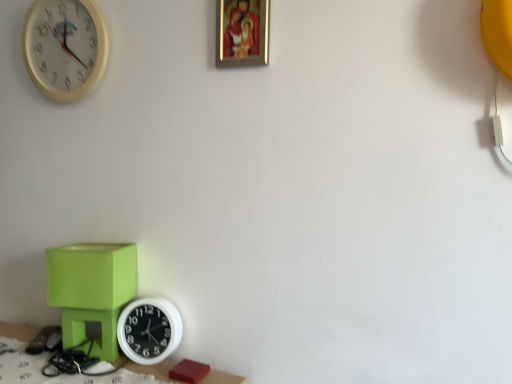
Question: From a real-world perspective, is white plastic wall clock at lower left, the 1th wall clock in the right-to-left sequence, physically above matte green cube at lower left?

Choices:
 (A) no
 (B) yes

Answer: (A)

Question: Is white plastic wall clock at lower left, which is counted as the 2th wall clock, starting from the left, at the left side of matte green cube at lower left?

Choices:
 (A) no
 (B) yes

Answer: (A)

Question: Does white plastic wall clock at lower left, the 1th wall clock in the right-to-left sequence, have a larger size compared to matte green cube at lower left?

Choices:
 (A) no
 (B) yes

Answer: (A)

Question: Is white plastic wall clock at lower left, the second wall clock when ordered from top to bottom, completely or partially outside of matte green cube at lower left?

Choices:
 (A) yes
 (B) no

Answer: (A)

Question: Considering the relative sizes of white plastic wall clock at lower left, which is the first wall clock in bottom-to-top order, and matte green cube at lower left in the image provided, is white plastic wall clock at lower left, which is the first wall clock in bottom-to-top order, smaller than matte green cube at lower left?

Choices:
 (A) yes
 (B) no

Answer: (A)

Question: Considering their positions, is matte green table at lower left located in front of or behind white plastic wall clock at upper left, marked as the second wall clock in a bottom-to-top arrangement?

Choices:
 (A) behind
 (B) front

Answer: (B)

Question: Is matte green table at lower left taller or shorter than white plastic wall clock at upper left, acting as the 1th wall clock starting from the top?

Choices:
 (A) tall
 (B) short

Answer: (B)

Question: From a real-world perspective, is matte green table at lower left above or below white plastic wall clock at upper left, which is the second wall clock in right-to-left order?

Choices:
 (A) above
 (B) below

Answer: (B)

Question: Is matte green table at lower left wider or thinner than white plastic wall clock at upper left, marked as the second wall clock in a bottom-to-top arrangement?

Choices:
 (A) wide
 (B) thin

Answer: (A)

Question: Considering the positions of gold-framed picture at upper center and matte green table at lower left in the image, is gold-framed picture at upper center bigger or smaller than matte green table at lower left?

Choices:
 (A) big
 (B) small

Answer: (B)

Question: Considering the positions of gold-framed picture at upper center and matte green table at lower left in the image, is gold-framed picture at upper center wider or thinner than matte green table at lower left?

Choices:
 (A) wide
 (B) thin

Answer: (B)

Question: Is gold-framed picture at upper center to the left or to the right of matte green table at lower left in the image?

Choices:
 (A) right
 (B) left

Answer: (A)

Question: From their relative heights in the image, would you say gold-framed picture at upper center is taller or shorter than matte green table at lower left?

Choices:
 (A) short
 (B) tall

Answer: (B)

Question: In terms of width, does matte green cube at lower left look wider or thinner when compared to white plastic wall clock at lower left, which is the first wall clock in bottom-to-top order?

Choices:
 (A) thin
 (B) wide

Answer: (B)

Question: Does point (91, 312) appear closer or farther from the camera than point (173, 336)?

Choices:
 (A) closer
 (B) farther

Answer: (B)